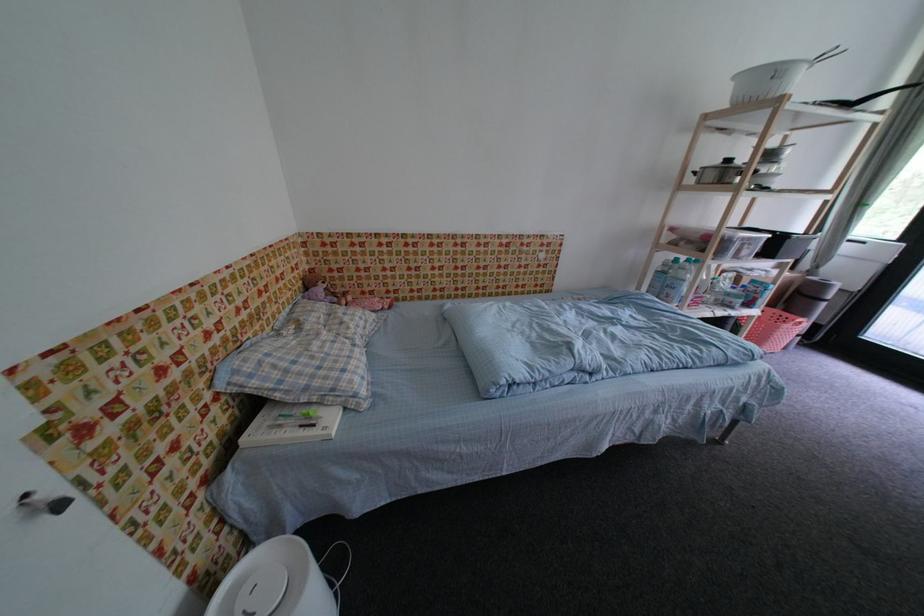
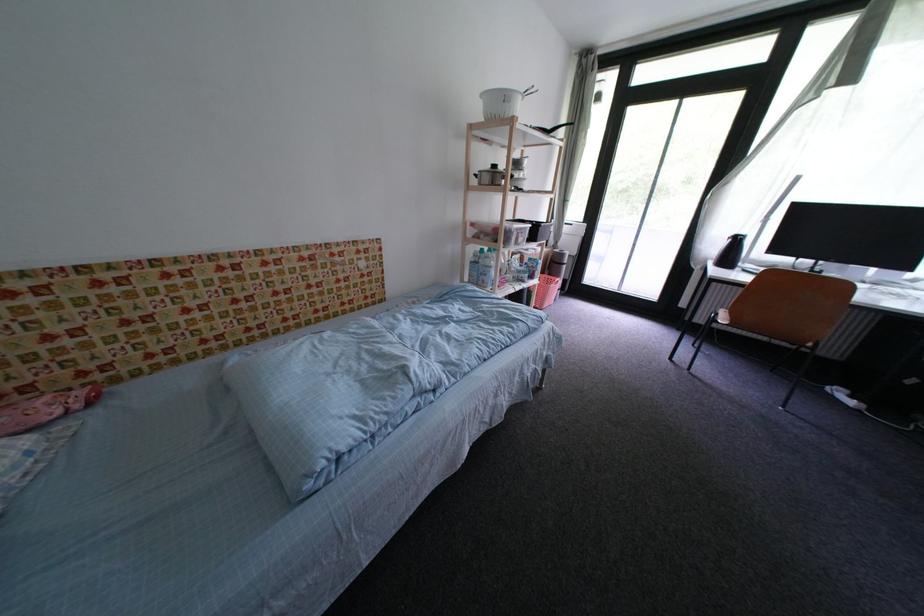
The point at (757,307) is marked in the first image. Where is the corresponding point in the second image?

(540, 280)